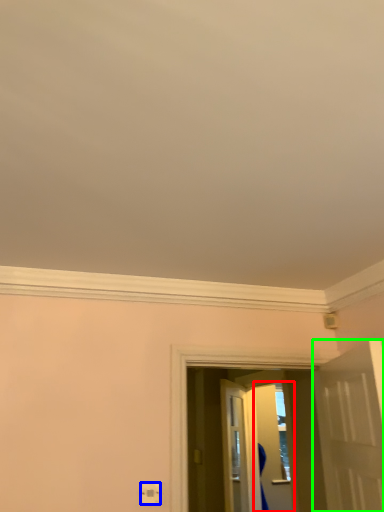
Question: Based on their relative distances, which object is nearer to screen door (highlighted by a red box)? Choose from electric outlet (highlighted by a blue box) and door (highlighted by a green box).

Choices:
 (A) electric outlet
 (B) door

Answer: (B)